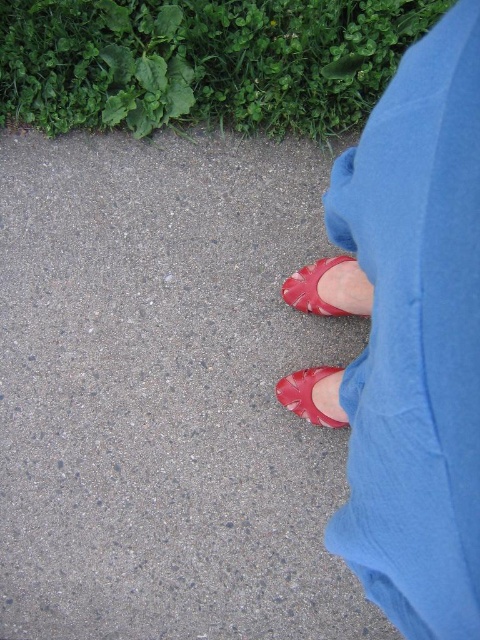
Question: Is smooth concrete pavement at center closer to the viewer compared to matte leather shoe at lower center?

Choices:
 (A) yes
 (B) no

Answer: (B)

Question: Which of the following is the farthest from the observer?

Choices:
 (A) matte red shoe at lower center
 (B) smooth concrete pavement at center
 (C) matte leather shoe at lower center
 (D) matte red shoes at lower center

Answer: (B)

Question: Can you confirm if matte red shoes at lower center is smaller than matte leather shoe at lower center?

Choices:
 (A) yes
 (B) no

Answer: (B)

Question: Does smooth concrete pavement at center appear on the left side of matte red shoe at lower center?

Choices:
 (A) yes
 (B) no

Answer: (A)

Question: Which object is positioned closest to the matte red shoe at lower center?

Choices:
 (A) matte leather shoe at lower center
 (B) smooth concrete pavement at center

Answer: (A)

Question: Which point is closer to the camera?

Choices:
 (A) (396, 388)
 (B) (147, 188)
 (C) (296, 307)
 (D) (278, 381)

Answer: (A)